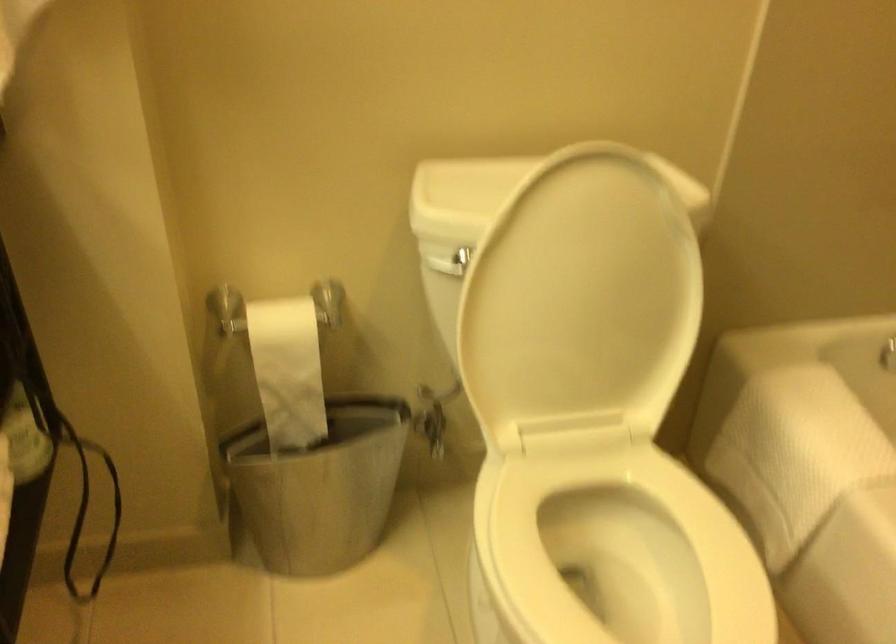
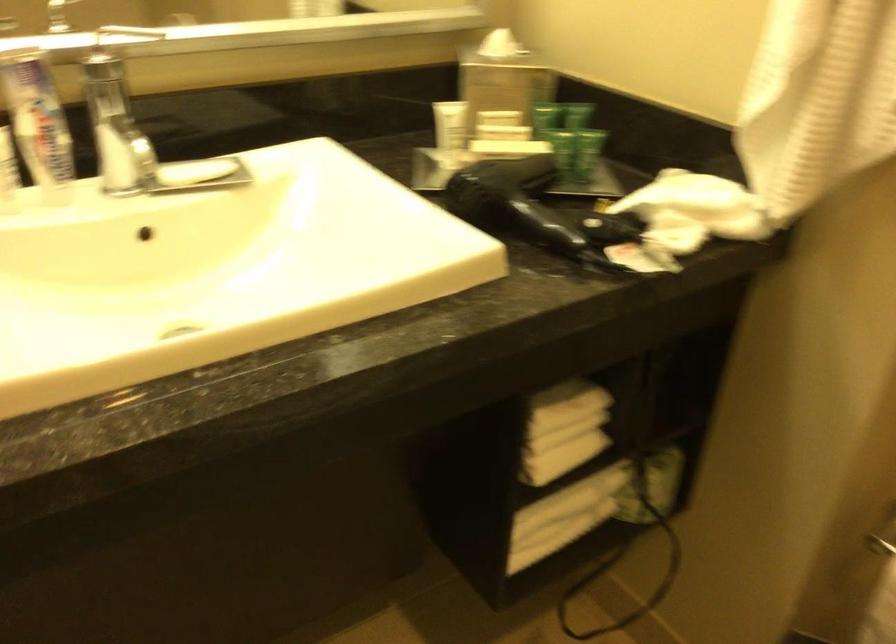
Question: The camera is either moving clockwise (left) or counter-clockwise (right) around the object. The first image is from the beginning of the video and the second image is from the end. Is the camera moving left or right when shooting the video?

Choices:
 (A) Left
 (B) Right

Answer: (B)